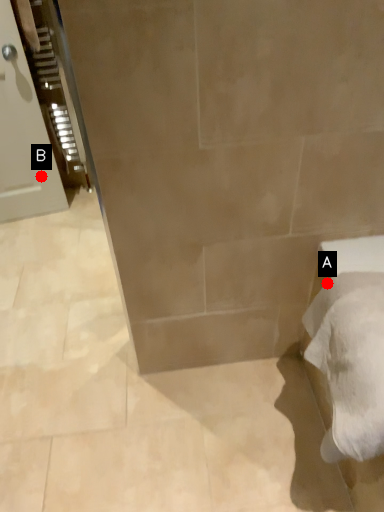
Question: Two points are circled on the image, labeled by A and B beside each circle. Which point is closer to the camera?

Choices:
 (A) A is closer
 (B) B is closer

Answer: (A)